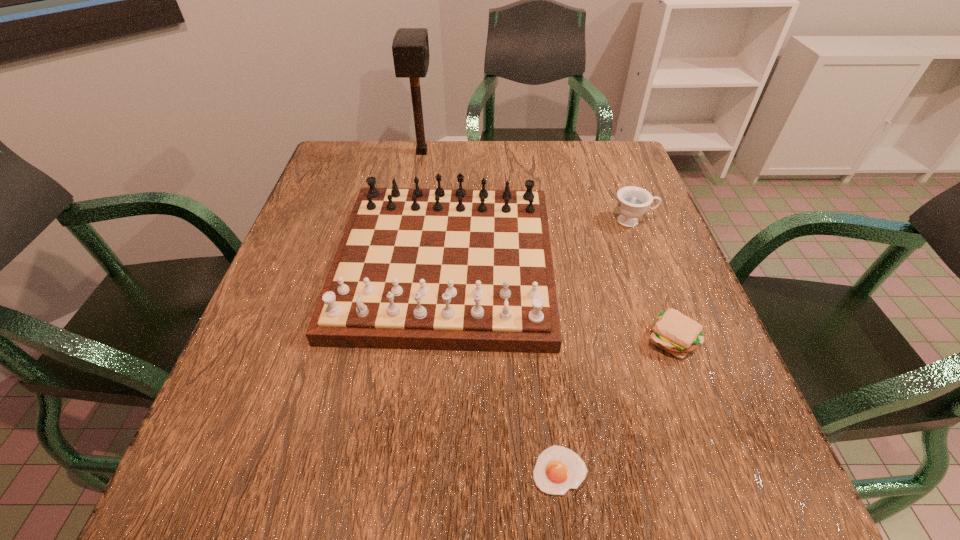
The image size is (960, 540). I want to click on vacant region that satisfies the following two spatial constraints: 1. on the side of the third tallest object with the handle; 2. on the front side of the shortest object, so click(x=728, y=470).

The image size is (960, 540). Find the location of `vacant area in the image that satisfies the following two spatial constraints: 1. on the side of the third shortest object with the handle; 2. on the front side of the shortest object`. vacant area in the image that satisfies the following two spatial constraints: 1. on the side of the third shortest object with the handle; 2. on the front side of the shortest object is located at coordinates (728, 470).

Find the location of a particular element. vacant space that satisfies the following two spatial constraints: 1. on the side of the teacup with the handle; 2. on the front side of the shortest object is located at coordinates (728, 470).